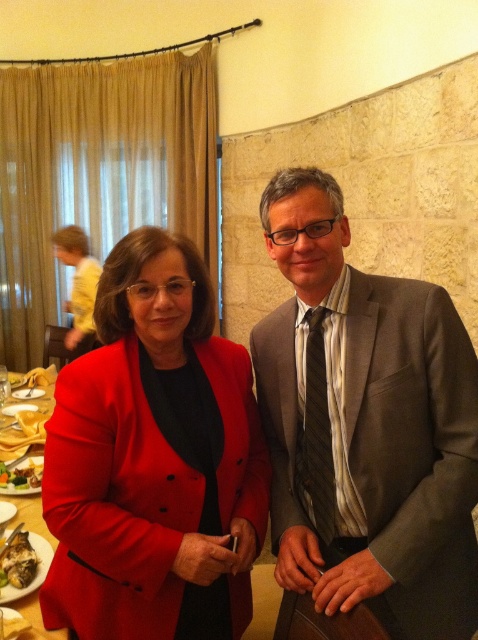
You are planning to place a new sofa in the living room. The sofa is as wide as the matte gray suit at center. Will it fit between the matte red table at lower left and the wall? Please explain.

The matte gray suit at center might be wider than the matte red table at lower left. Since the sofa is as wide as the matte gray suit at center, it may not fit between the matte red table at lower left and the wall if the space available is narrower than the sofa.

You are organizing a charity event and need to decide which item to display first. The matte red blazer at center and the shiny silver oyster at lower left are both candidates. Based on their sizes, which one should be placed in a more prominent position to attract attention?

The matte red blazer at center should be placed in a more prominent position because it has a larger size compared to the shiny silver oyster at lower left, making it more eye catching.